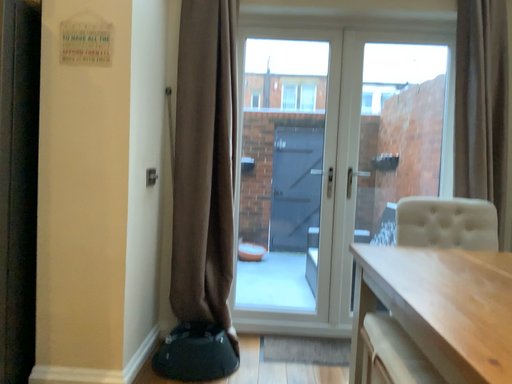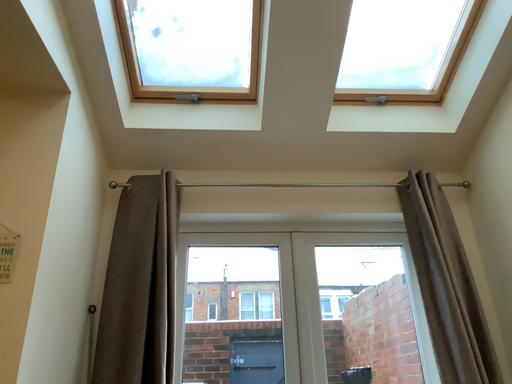
Question: How did the camera likely rotate when shooting the video?

Choices:
 (A) rotated upward
 (B) rotated downward

Answer: (A)